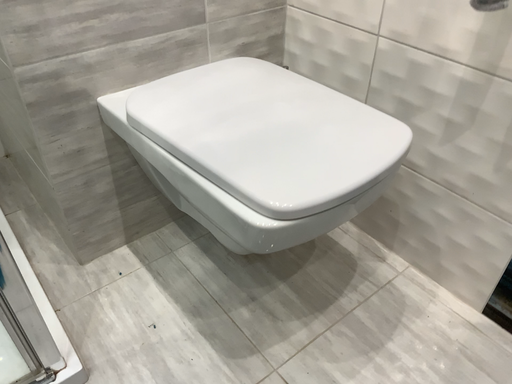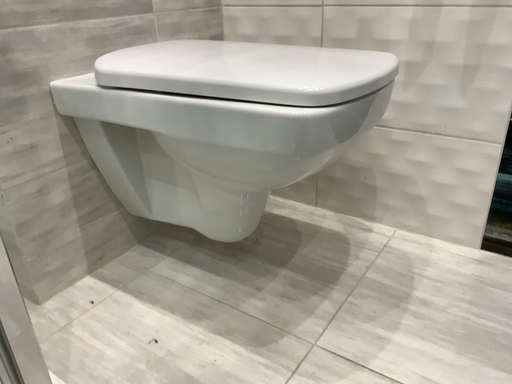
Question: Which way did the camera rotate in the video?

Choices:
 (A) rotated left
 (B) rotated right

Answer: (B)